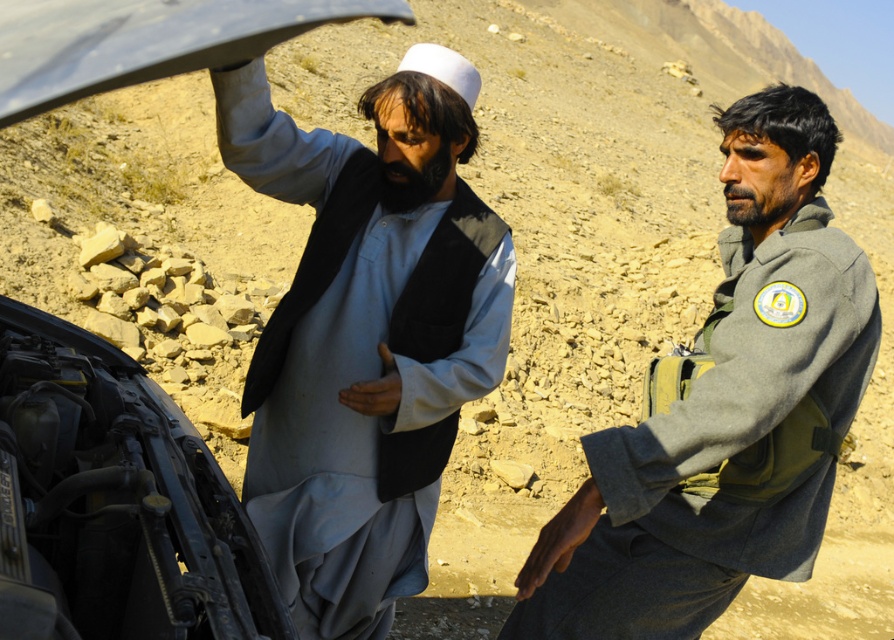
Does light blue fabric at center have a greater width compared to metallic gray hood at upper left?

Correct, the width of light blue fabric at center exceeds that of metallic gray hood at upper left.

The width and height of the screenshot is (894, 640). What do you see at coordinates (365, 339) in the screenshot? I see `light blue fabric at center` at bounding box center [365, 339].

What are the coordinates of `light blue fabric at center` in the screenshot? It's located at (365, 339).

Who is more forward, (321, 582) or (211, 552)?

Point (211, 552) is more forward.

Who is positioned more to the left, light blue fabric at center or metallic engine at lower left?

Positioned to the left is metallic engine at lower left.

Locate an element on the screen. This screenshot has width=894, height=640. light blue fabric at center is located at coordinates (365, 339).

Locate an element on the screen. light blue fabric at center is located at coordinates (365, 339).

Who is positioned more to the left, metallic engine at lower left or metallic gray hood at upper left?

From the viewer's perspective, metallic engine at lower left appears more on the left side.

Is metallic engine at lower left wider than metallic gray hood at upper left?

Yes.

Is point (38, 616) closer to camera compared to point (63, 88)?

No.

Locate an element on the screen. metallic engine at lower left is located at coordinates (114, 502).